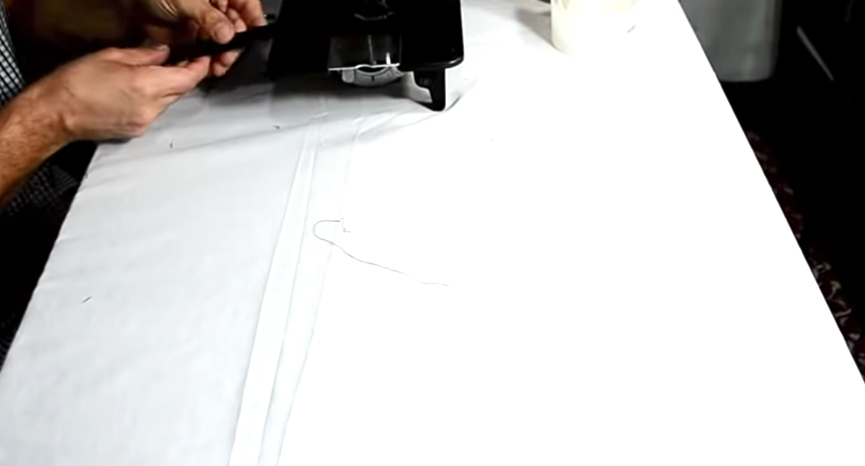
Find the location of a particular element. The width and height of the screenshot is (865, 466). tables is located at coordinates (517, 210).